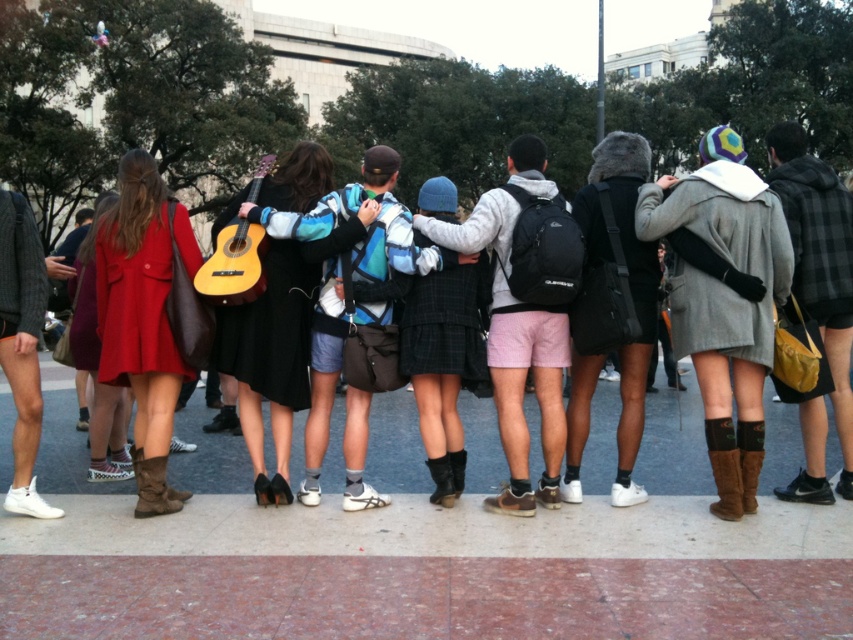
Question: Does gray wool coat at center appear on the right side of light wood acoustic guitar at center?

Choices:
 (A) no
 (B) yes

Answer: (B)

Question: Which object is farther from the camera taking this photo?

Choices:
 (A) brown suede boot at lower right
 (B) wooden guitar at center

Answer: (B)

Question: Is matte red coat at left smaller than light wood acoustic guitar at center?

Choices:
 (A) yes
 (B) no

Answer: (B)

Question: Which is farther from the gray wool coat at center?

Choices:
 (A) wooden guitar at center
 (B) light wood acoustic guitar at center

Answer: (B)

Question: Can you confirm if matte red coat at left is positioned to the right of brown suede boot at lower right?

Choices:
 (A) no
 (B) yes

Answer: (A)

Question: Which is nearer to the brown suede boot at lower left?

Choices:
 (A) gray wool coat at center
 (B) pink marble pavement at center
 (C) light wood acoustic guitar at center

Answer: (B)